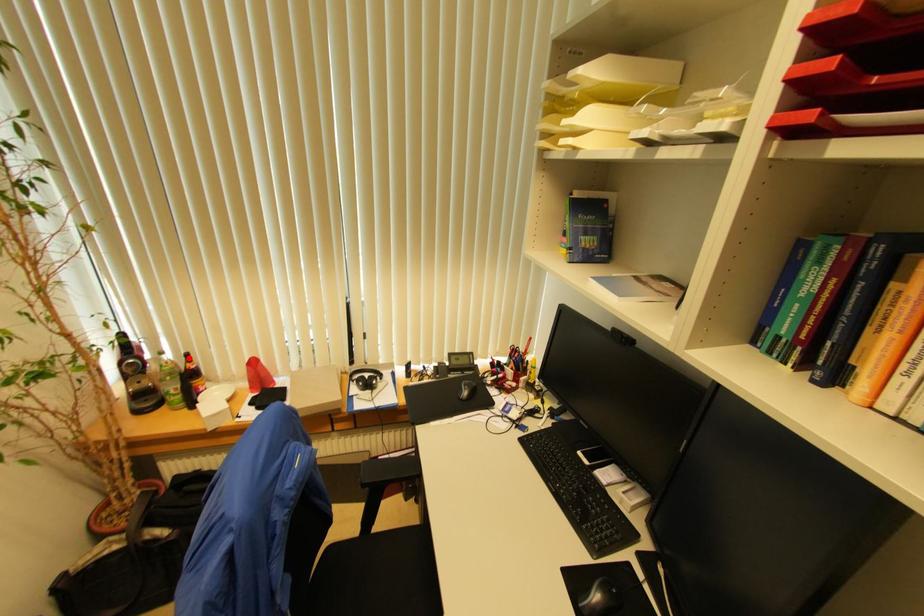
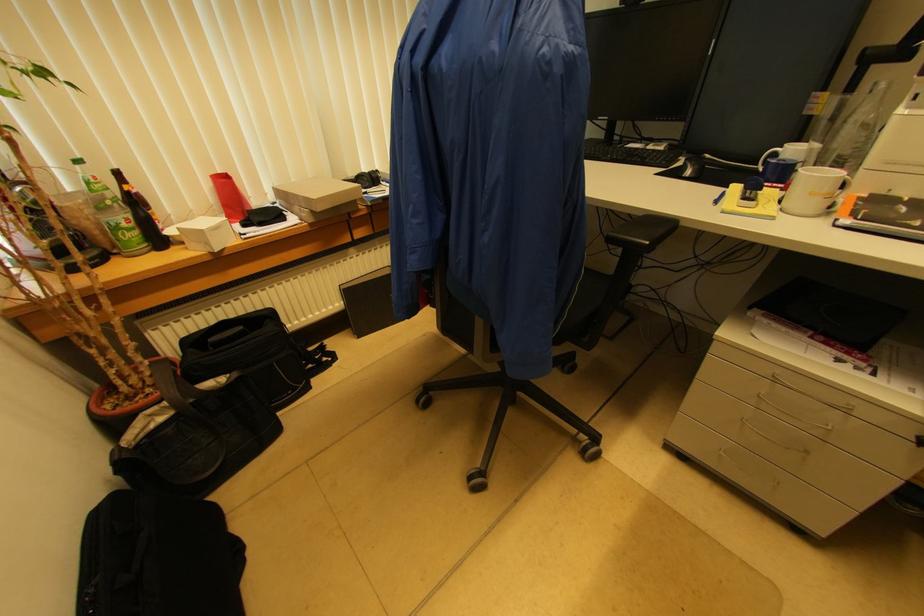
Find the pixel in the second image that matches the highlighted location in the first image.

(118, 176)